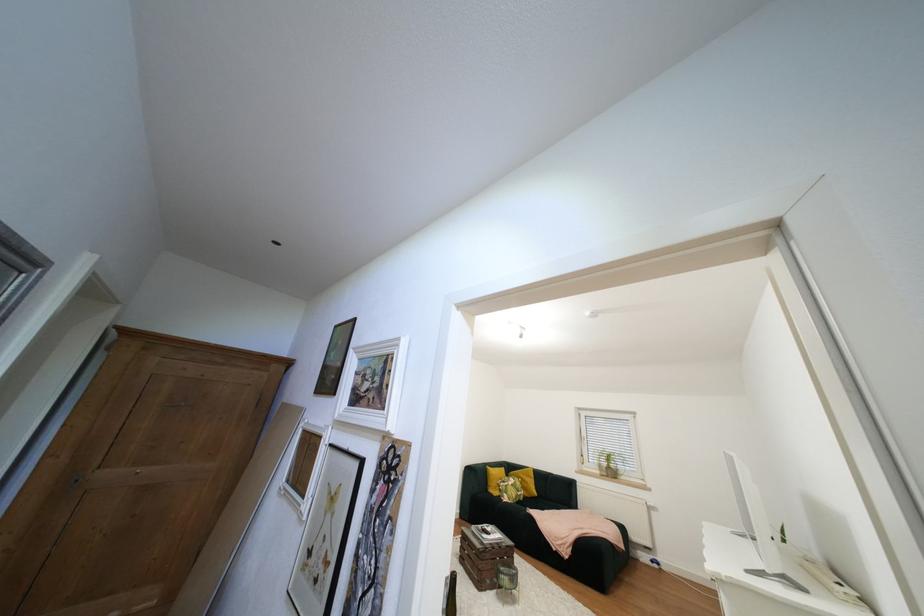
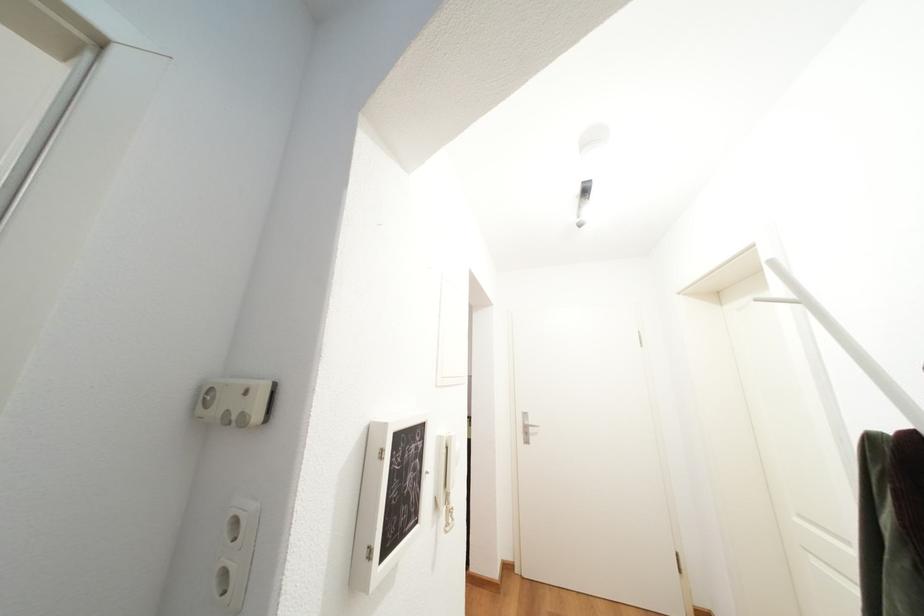
Based on the continuous images, in which direction is the camera rotating?

The camera's rotation is toward right-up.